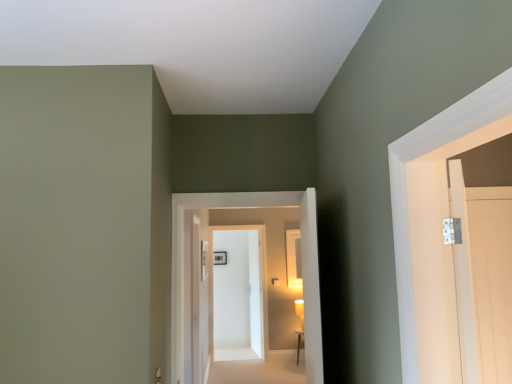
Question: Can you confirm if light wood door at right, arranged as the second door when viewed from the front, is smaller than white glossy door at center, the fourth door from the right?

Choices:
 (A) yes
 (B) no

Answer: (A)

Question: Is light wood door at right, the fourth door when ordered from left to right, located outside white glossy door at center, arranged as the 2th door when viewed from the back?

Choices:
 (A) yes
 (B) no

Answer: (A)

Question: From a real-world perspective, is light wood door at right, acting as the 3th door starting from the back, under white glossy door at center, placed as the 3th door when sorted from front to back?

Choices:
 (A) no
 (B) yes

Answer: (A)

Question: Is light wood door at right, the fourth door when ordered from left to right, not close to white glossy door at center, placed as the 3th door when sorted from front to back?

Choices:
 (A) no
 (B) yes

Answer: (B)

Question: Is light wood door at right, the fourth door when ordered from left to right, wider than white glossy door at center, which ranks as the 1th door in left-to-right order?

Choices:
 (A) no
 (B) yes

Answer: (A)

Question: From the image's perspective, is white glossy door at center, which is the 1th door from front to back, located above or below matte gold wall sconce at center?

Choices:
 (A) above
 (B) below

Answer: (A)

Question: In terms of height, does white glossy door at center, arranged as the second door when viewed from the right, look taller or shorter compared to matte gold wall sconce at center?

Choices:
 (A) short
 (B) tall

Answer: (B)

Question: Is white glossy door at center, which appears as the 3th door when viewed from the left, bigger or smaller than matte gold wall sconce at center?

Choices:
 (A) small
 (B) big

Answer: (B)

Question: In terms of width, does white glossy door at center, arranged as the second door when viewed from the right, look wider or thinner when compared to matte gold wall sconce at center?

Choices:
 (A) wide
 (B) thin

Answer: (B)

Question: Based on their sizes in the image, would you say white glossy door at center, the 3th door viewed from the right, is bigger or smaller than light wood door at right, which ranks as the first door in right-to-left order?

Choices:
 (A) big
 (B) small

Answer: (A)

Question: Is point (240, 266) closer or farther from the camera than point (463, 206)?

Choices:
 (A) closer
 (B) farther

Answer: (B)

Question: Is white glossy door at center, placed as the fourth door when sorted from front to back, taller or shorter than light wood door at right, which ranks as the first door in right-to-left order?

Choices:
 (A) tall
 (B) short

Answer: (A)

Question: Visually, is white glossy door at center, the 3th door viewed from the right, positioned to the left or to the right of light wood door at right, the fourth door when ordered from left to right?

Choices:
 (A) left
 (B) right

Answer: (A)

Question: Based on their positions, is white glossy door at center, which appears as the first door when viewed from the back, located to the left or right of white glossy door at center, the fourth door from the right?

Choices:
 (A) right
 (B) left

Answer: (A)

Question: Relative to white glossy door at center, placed as the 3th door when sorted from front to back, is white glossy door at center, arranged as the second door when viewed from the left, in front or behind?

Choices:
 (A) front
 (B) behind

Answer: (B)